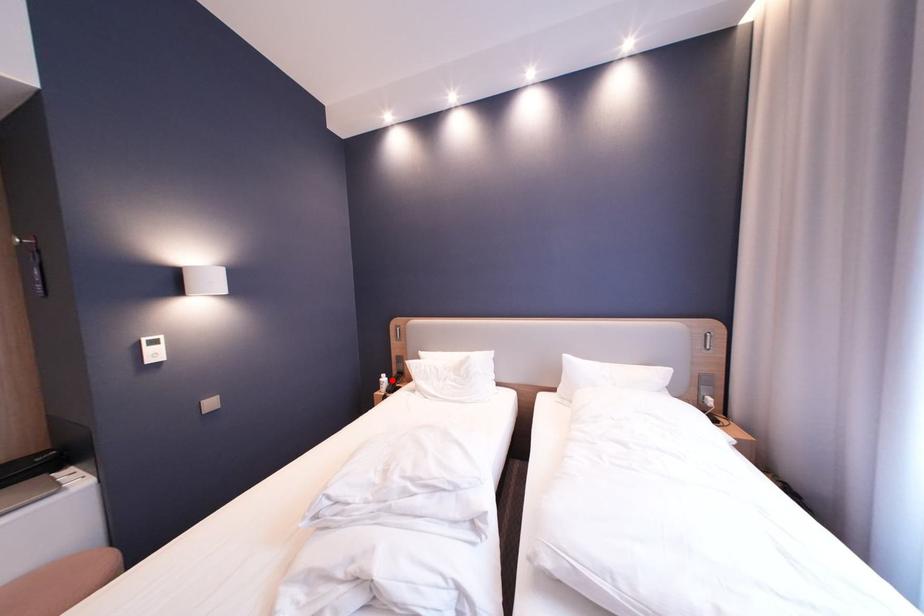
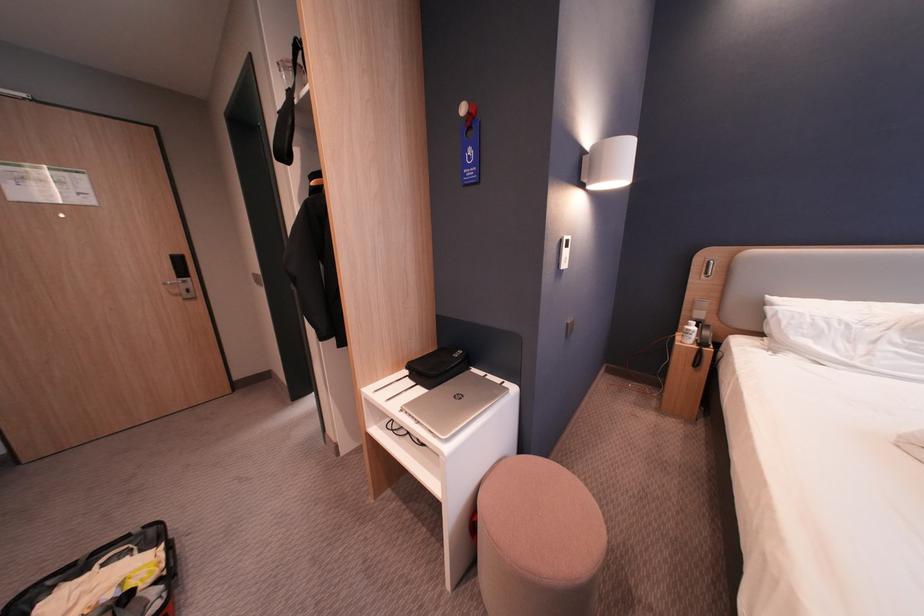
Question: I am providing you with two images of the same scene from different viewpoints. In image1, a red point is highlighted. Considering the same 3D point in image2, which of the following is correct?

Choices:
 (A) It is closer
 (B) It is farther

Answer: (A)